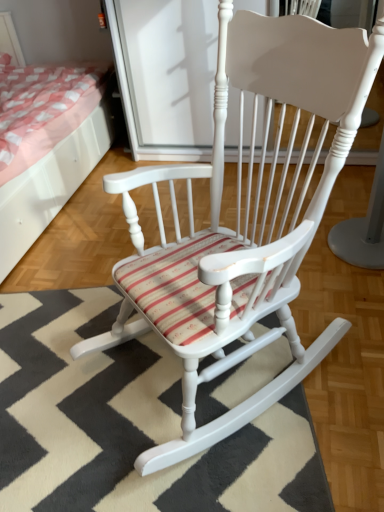
Question: Is there a large distance between matte pink fabric bed at upper left and striped fabric doormat at center?

Choices:
 (A) yes
 (B) no

Answer: (B)

Question: Can you confirm if matte pink fabric bed at upper left is smaller than striped fabric doormat at center?

Choices:
 (A) no
 (B) yes

Answer: (A)

Question: Is matte pink fabric bed at upper left shorter than striped fabric doormat at center?

Choices:
 (A) yes
 (B) no

Answer: (B)

Question: Is the position of matte pink fabric bed at upper left less distant than that of striped fabric doormat at center?

Choices:
 (A) no
 (B) yes

Answer: (A)

Question: Does matte pink fabric bed at upper left have a lesser width compared to striped fabric doormat at center?

Choices:
 (A) yes
 (B) no

Answer: (B)

Question: Does matte pink fabric bed at upper left have a greater width compared to striped fabric doormat at center?

Choices:
 (A) no
 (B) yes

Answer: (B)

Question: From a real-world perspective, is striped fabric doormat at center positioned under matte pink fabric bed at upper left based on gravity?

Choices:
 (A) no
 (B) yes

Answer: (B)

Question: Is striped fabric doormat at center completely or partially outside of matte pink fabric bed at upper left?

Choices:
 (A) no
 (B) yes

Answer: (B)

Question: Could matte pink fabric bed at upper left be considered to be inside striped fabric doormat at center?

Choices:
 (A) no
 (B) yes

Answer: (A)

Question: Can you confirm if striped fabric doormat at center is taller than matte pink fabric bed at upper left?

Choices:
 (A) no
 (B) yes

Answer: (A)

Question: Considering the relative sizes of striped fabric doormat at center and matte pink fabric bed at upper left in the image provided, is striped fabric doormat at center smaller than matte pink fabric bed at upper left?

Choices:
 (A) no
 (B) yes

Answer: (B)

Question: Is striped fabric doormat at center aimed at matte pink fabric bed at upper left?

Choices:
 (A) no
 (B) yes

Answer: (A)

Question: Considering the relative positions of striped fabric doormat at center and matte pink fabric bed at upper left in the image provided, is striped fabric doormat at center to the left or to the right of matte pink fabric bed at upper left?

Choices:
 (A) right
 (B) left

Answer: (A)